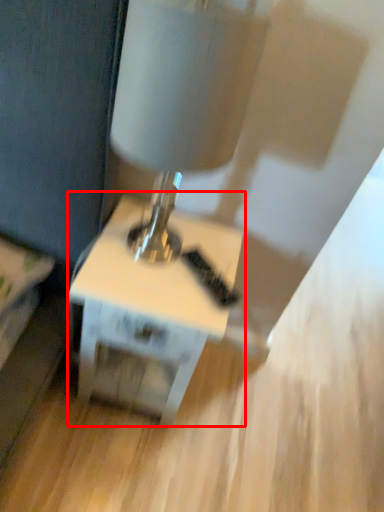
Question: Considering the relative positions of table (annotated by the red box) and table lamp in the image provided, where is table (annotated by the red box) located with respect to the staircase?

Choices:
 (A) right
 (B) left

Answer: (B)